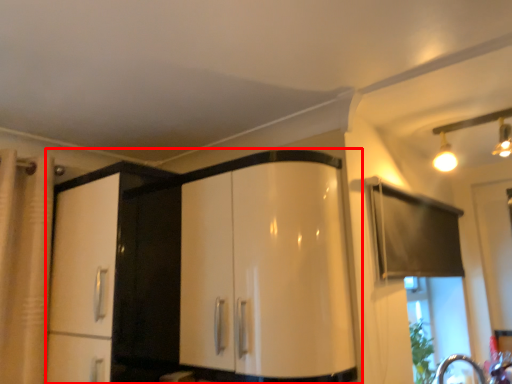
Question: Where is cabinetry (annotated by the red box) located in relation to light fixture in the image?

Choices:
 (A) right
 (B) left

Answer: (B)